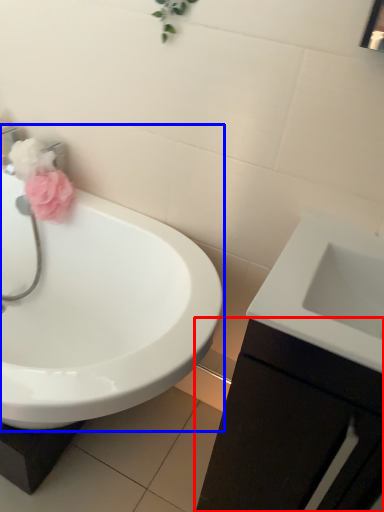
Question: Which point is closer to the camera, bathroom cabinet (highlighted by a red box) or sink (highlighted by a blue box)?

Choices:
 (A) bathroom cabinet
 (B) sink

Answer: (A)